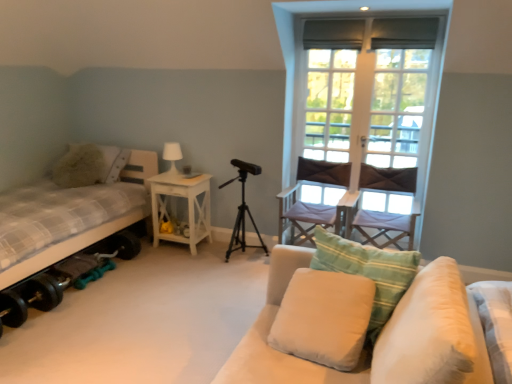
Question: Considering the relative positions of checkered fabric bed at left and white wood screen door at upper right in the image provided, is checkered fabric bed at left to the right of white wood screen door at upper right from the viewer's perspective?

Choices:
 (A) no
 (B) yes

Answer: (A)

Question: Does checkered fabric bed at left have a greater height compared to white wood screen door at upper right?

Choices:
 (A) yes
 (B) no

Answer: (B)

Question: Does checkered fabric bed at left have a greater width compared to white wood screen door at upper right?

Choices:
 (A) no
 (B) yes

Answer: (B)

Question: Is checkered fabric bed at left at the left side of white wood screen door at upper right?

Choices:
 (A) yes
 (B) no

Answer: (A)

Question: From a real-world perspective, is checkered fabric bed at left positioned over white wood screen door at upper right based on gravity?

Choices:
 (A) yes
 (B) no

Answer: (B)

Question: Is checkered fabric bed at left further to the viewer compared to white wood screen door at upper right?

Choices:
 (A) yes
 (B) no

Answer: (B)

Question: Does light beige fabric pillow at center, acting as the 3th pillow starting from the left, lie behind white wood nightstand at center?

Choices:
 (A) no
 (B) yes

Answer: (A)

Question: Does light beige fabric pillow at center, acting as the 3th pillow starting from the left, have a greater height compared to white wood nightstand at center?

Choices:
 (A) yes
 (B) no

Answer: (B)

Question: Considering the relative sizes of light beige fabric pillow at center, the 2th pillow in the back-to-front sequence, and white wood nightstand at center in the image provided, is light beige fabric pillow at center, the 2th pillow in the back-to-front sequence, thinner than white wood nightstand at center?

Choices:
 (A) no
 (B) yes

Answer: (B)

Question: Is light beige fabric pillow at center, placed as the third pillow when sorted from front to back, closer to camera compared to white wood nightstand at center?

Choices:
 (A) no
 (B) yes

Answer: (B)

Question: Can you confirm if light beige fabric pillow at center, acting as the 3th pillow starting from the left, is positioned to the right of white wood nightstand at center?

Choices:
 (A) yes
 (B) no

Answer: (A)

Question: Is white wood nightstand at center located within light beige fabric pillow at center, the 2th pillow in the back-to-front sequence?

Choices:
 (A) yes
 (B) no

Answer: (B)

Question: Can you confirm if fluffy beige pillow at left, the fourth pillow when ordered from front to back, is smaller than white wood window at upper right?

Choices:
 (A) yes
 (B) no

Answer: (B)